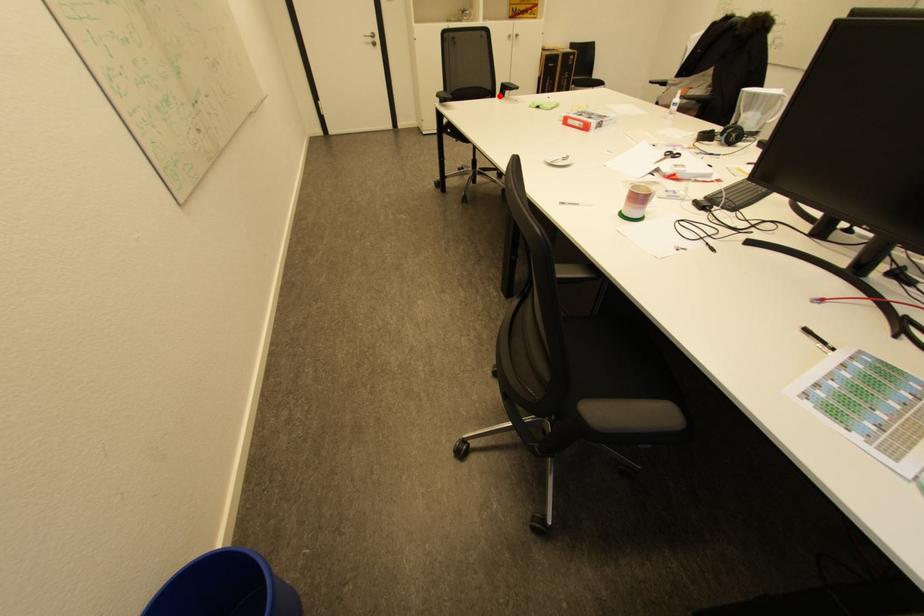
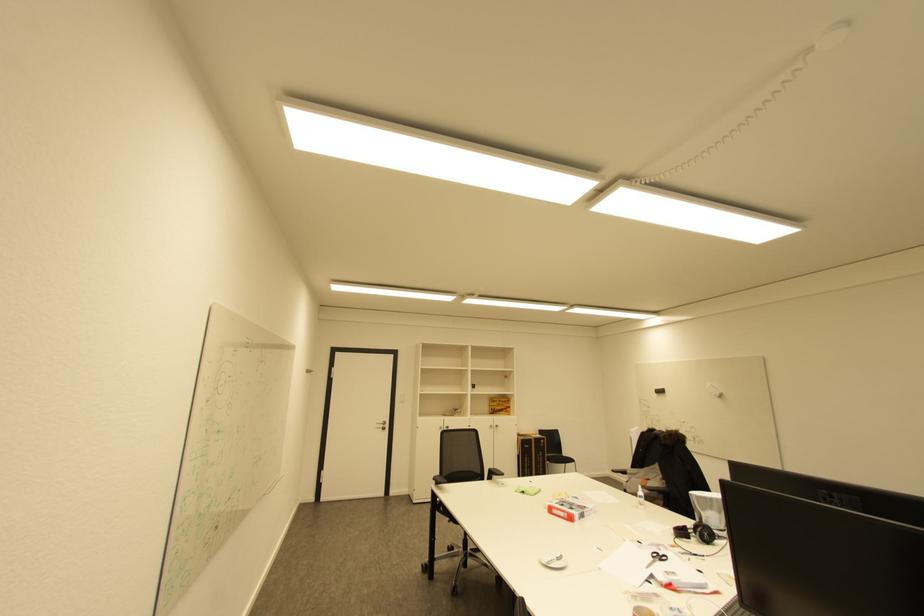
In the second image, find the point that corresponds to the highlighted location in the first image.

(488, 479)